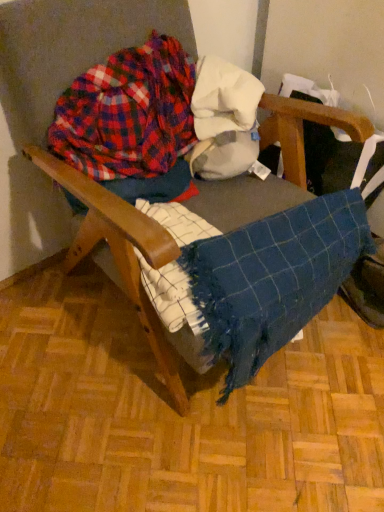
Question: Would you say plaid fabric at upper left is outside blue woven blanket at center?

Choices:
 (A) yes
 (B) no

Answer: (A)

Question: Is blue woven blanket at center inside plaid fabric at upper left?

Choices:
 (A) no
 (B) yes

Answer: (A)

Question: Is plaid fabric at upper left closer to the viewer compared to blue woven blanket at center?

Choices:
 (A) no
 (B) yes

Answer: (A)

Question: Can you confirm if plaid fabric at upper left is smaller than blue woven blanket at center?

Choices:
 (A) no
 (B) yes

Answer: (B)

Question: Is plaid fabric at upper left far from blue woven blanket at center?

Choices:
 (A) yes
 (B) no

Answer: (B)

Question: Does plaid fabric at upper left have a greater height compared to blue woven blanket at center?

Choices:
 (A) yes
 (B) no

Answer: (B)

Question: Considering the relative sizes of blue woven blanket at center and plaid fabric at upper left in the image provided, is blue woven blanket at center thinner than plaid fabric at upper left?

Choices:
 (A) no
 (B) yes

Answer: (A)

Question: Is blue woven blanket at center far away from plaid fabric at upper left?

Choices:
 (A) no
 (B) yes

Answer: (A)

Question: Is blue woven blanket at center aimed at plaid fabric at upper left?

Choices:
 (A) yes
 (B) no

Answer: (B)

Question: Considering the relative sizes of blue woven blanket at center and plaid fabric at upper left in the image provided, is blue woven blanket at center smaller than plaid fabric at upper left?

Choices:
 (A) yes
 (B) no

Answer: (B)

Question: Considering the relative positions of blue woven blanket at center and plaid fabric at upper left in the image provided, is blue woven blanket at center behind plaid fabric at upper left?

Choices:
 (A) no
 (B) yes

Answer: (A)

Question: Is the position of blue woven blanket at center less distant than that of plaid fabric at upper left?

Choices:
 (A) yes
 (B) no

Answer: (A)

Question: Considering their positions, is blue woven blanket at center located in front of or behind plaid fabric at upper left?

Choices:
 (A) behind
 (B) front

Answer: (B)